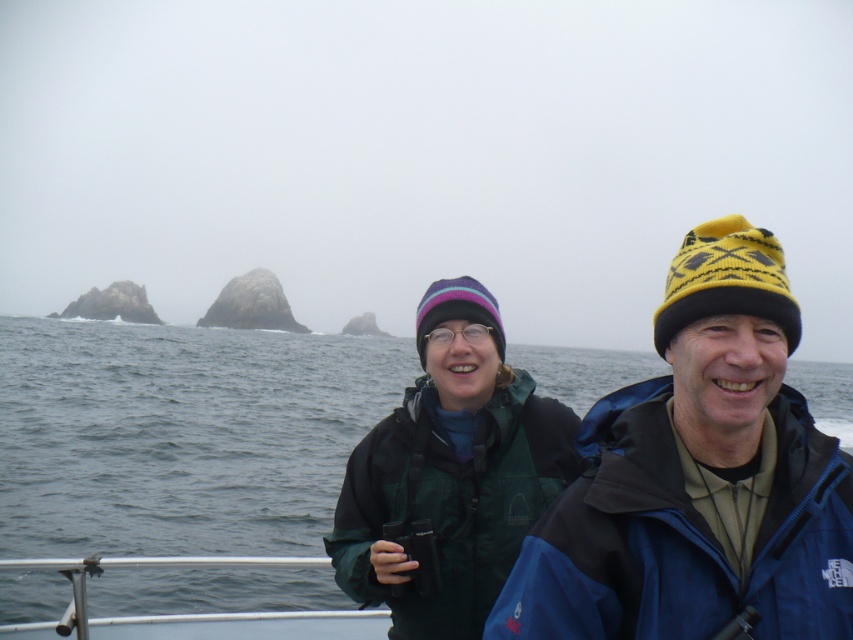
Question: Does gray water at center lie behind blue fleece jacket at right?

Choices:
 (A) no
 (B) yes

Answer: (B)

Question: Does gray water at center appear on the left side of blue fleece jacket at right?

Choices:
 (A) no
 (B) yes

Answer: (B)

Question: Is gray water at center wider than green matte jacket at center?

Choices:
 (A) no
 (B) yes

Answer: (B)

Question: Which of the following is the farthest from the observer?

Choices:
 (A) gray water at center
 (B) green matte jacket at center
 (C) polished metal railing at lower left
 (D) blue fleece jacket at right

Answer: (C)

Question: Which object is the closest to the blue fleece jacket at right?

Choices:
 (A) polished metal railing at lower left
 (B) green matte jacket at center
 (C) gray water at center

Answer: (B)

Question: Among these points, which one is nearest to the camera?

Choices:
 (A) (381, 516)
 (B) (778, 280)
 (C) (12, 632)
 (D) (35, 608)

Answer: (B)